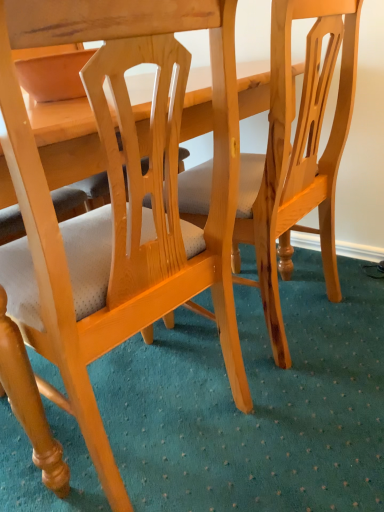
This screenshot has height=512, width=384. I want to click on free space in front of light brown wood chair at center, which is counted as the second chair, starting from the left, so click(x=326, y=394).